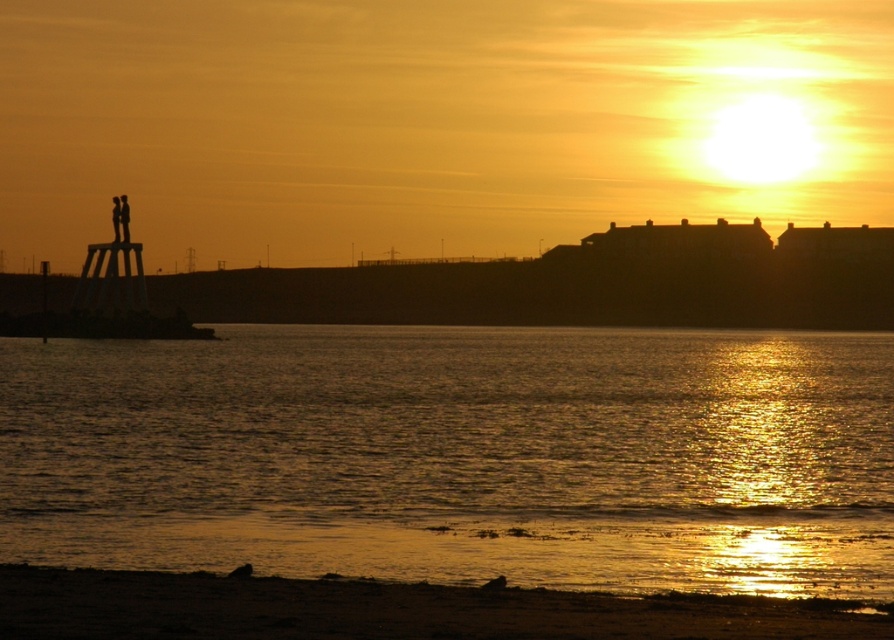
Question: Which point is closer to the camera?

Choices:
 (A) golden reflective water at lower center
 (B) silhouette figure at left
 (C) black silhouette at left
 (D) sandy brown beach at lower center

Answer: (D)

Question: Among these objects, which one is nearest to the camera?

Choices:
 (A) silhouette figure at left
 (B) golden reflective water at lower center

Answer: (B)

Question: Is golden reflective water at lower center to the right of black silhouette at left from the viewer's perspective?

Choices:
 (A) yes
 (B) no

Answer: (A)

Question: Which object is the closest to the silhouette figure at left?

Choices:
 (A) golden reflective water at lower center
 (B) sandy brown beach at lower center
 (C) black silhouette at left

Answer: (C)

Question: Does golden reflective water at lower center have a greater width compared to silhouette figure at left?

Choices:
 (A) no
 (B) yes

Answer: (B)

Question: Where is golden reflective water at lower center located in relation to sandy brown beach at lower center in the image?

Choices:
 (A) above
 (B) below

Answer: (B)